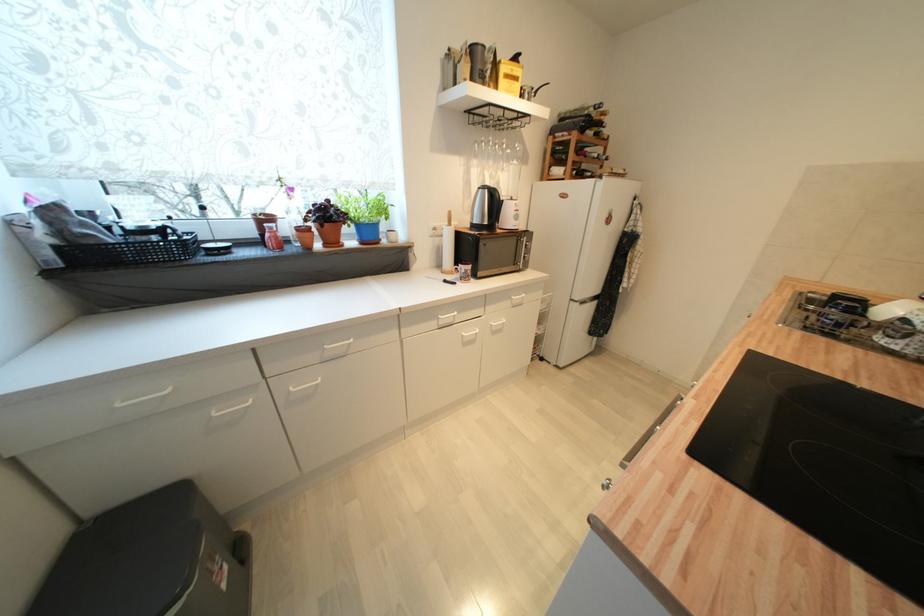
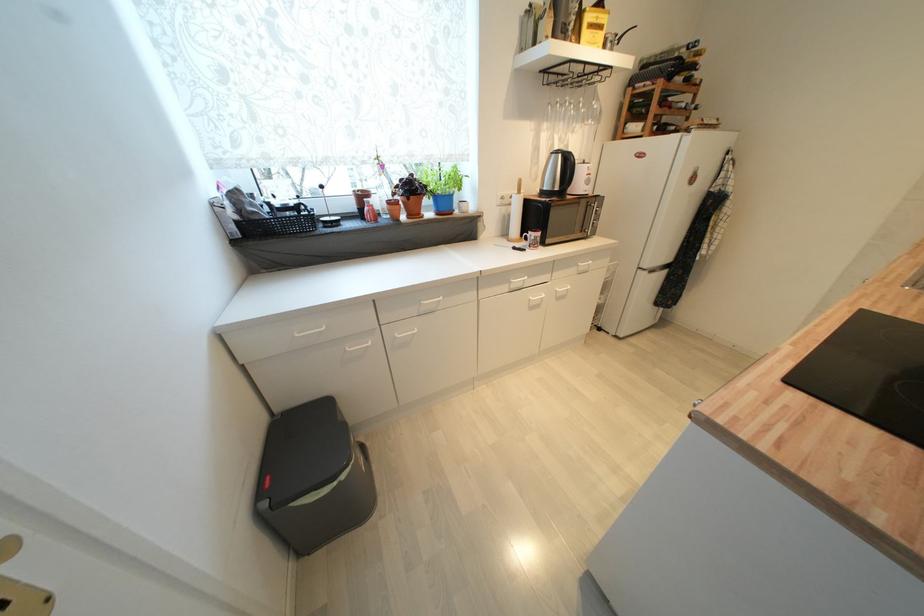
Where in the second image is the point corresponding to (491,225) from the first image?

(562, 191)